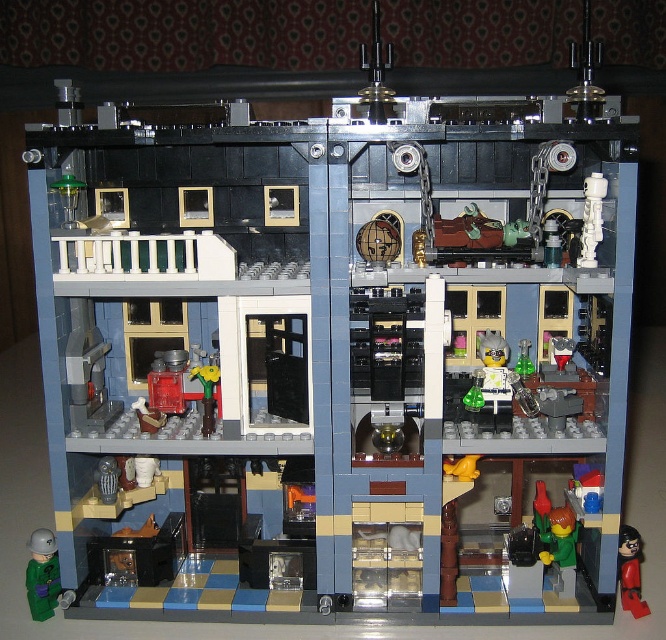
Question: Which point is closer to the camera?

Choices:
 (A) [637, 616]
 (B) [57, 573]
 (C) [496, 406]

Answer: (A)

Question: Which object appears farthest from the camera in this image?

Choices:
 (A) translucent yellow plastic at center
 (B) shiny black figure at lower right
 (C) green matte figure at lower left

Answer: (A)

Question: Is green matte figure at lower left bigger than translucent yellow plastic at center?

Choices:
 (A) no
 (B) yes

Answer: (A)

Question: Can you confirm if green matte figure at lower left is positioned below translucent yellow plastic at center?

Choices:
 (A) yes
 (B) no

Answer: (A)

Question: Considering the relative positions of translucent yellow plastic at center and shiny black figure at lower right in the image provided, where is translucent yellow plastic at center located with respect to shiny black figure at lower right?

Choices:
 (A) right
 (B) left

Answer: (B)

Question: Considering the real-world distances, which object is farthest from the translucent yellow plastic at center?

Choices:
 (A) green matte figure at lower left
 (B) shiny black figure at lower right

Answer: (A)